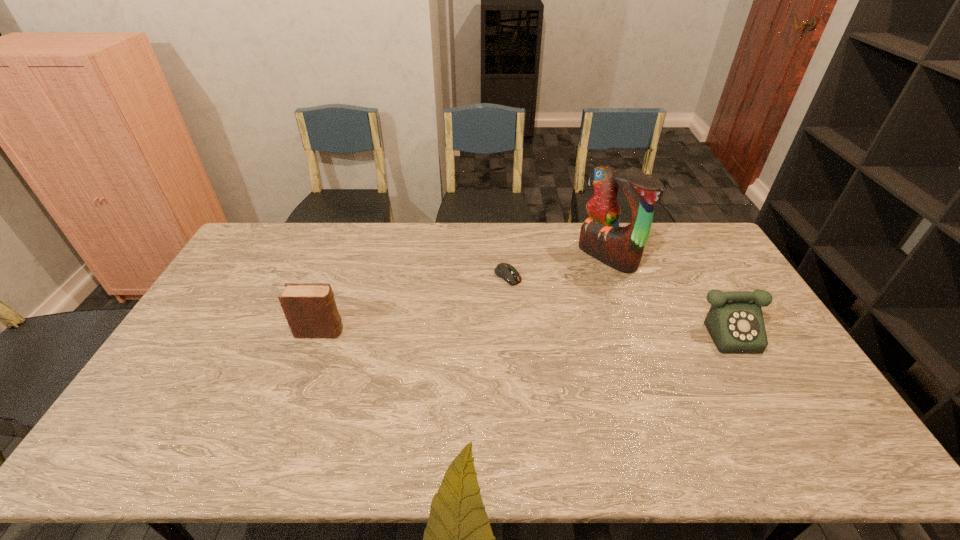
Where is `diary`? diary is located at coordinates (310, 309).

This screenshot has height=540, width=960. Identify the location of the third shortest object. (310, 309).

Find the location of a particular element. This screenshot has width=960, height=540. the rightmost object is located at coordinates (735, 322).

This screenshot has height=540, width=960. Find the location of `the second shortest object`. the second shortest object is located at coordinates (735, 322).

The image size is (960, 540). I want to click on the shortest object, so click(507, 272).

At what (x,y) coordinates should I click in order to perform the action: click on computer equipment. Please return your answer as a coordinate pair (x, y). The width and height of the screenshot is (960, 540). Looking at the image, I should click on (507, 272).

You are a GUI agent. You are given a task and a screenshot of the screen. Output one action in this format:
    pyautogui.click(x=<x>, y=<y>)
    Task: Click on the tallest object
    This screenshot has height=540, width=960.
    Given the screenshot: What is the action you would take?
    pos(621,248)

Where is `the second object from right to left`? the second object from right to left is located at coordinates point(621,248).

Image resolution: width=960 pixels, height=540 pixels. I want to click on free space located 0.340m on the spine side of the diary, so click(x=457, y=332).

Where is `free space located on the dial of the second shortest object`? The height and width of the screenshot is (540, 960). free space located on the dial of the second shortest object is located at coordinates (787, 403).